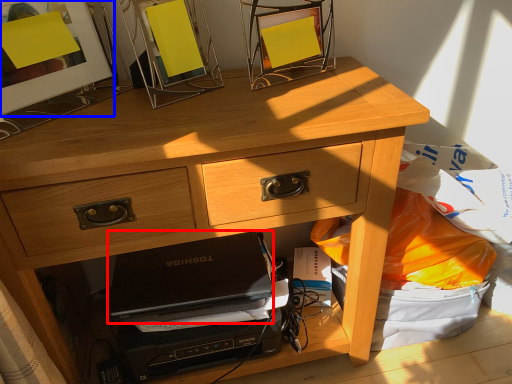
Question: Which of the following is the farthest to the observer, laptop (highlighted by a red box) or picture frame (highlighted by a blue box)?

Choices:
 (A) laptop
 (B) picture frame

Answer: (A)